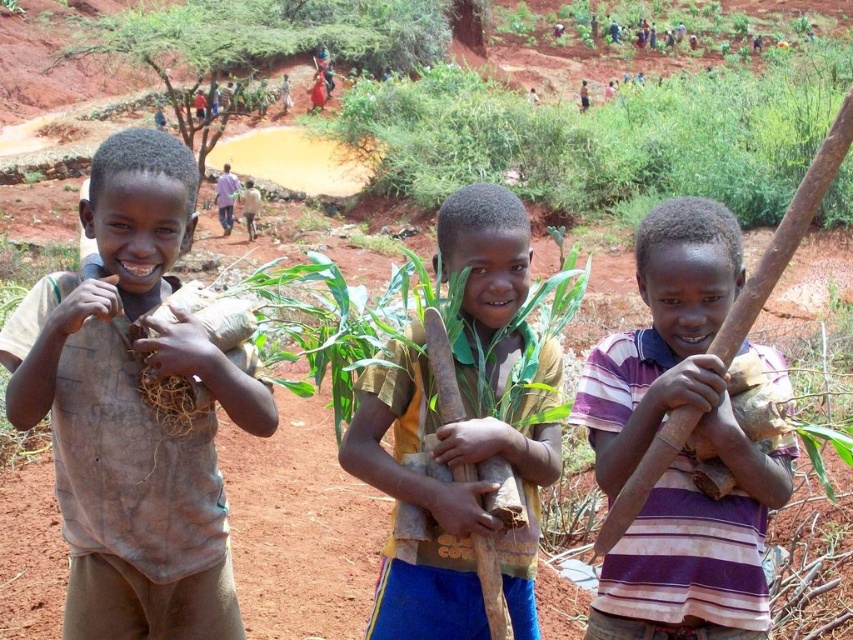
Question: Which of the following is the farthest from the observer?

Choices:
 (A) yellow cotton shirt at center
 (B) brown mud shirt at left
 (C) green leafy plant at upper center

Answer: (A)

Question: Which of the following is the closest to the observer?

Choices:
 (A) brown mud shirt at left
 (B) green leafy plant at upper center
 (C) yellow cotton shirt at center

Answer: (B)

Question: Can you confirm if green leafy plant at upper center is thinner than purple striped shirt at center?

Choices:
 (A) no
 (B) yes

Answer: (A)

Question: Can you confirm if brown mud shirt at left is bigger than purple striped shirt at center?

Choices:
 (A) yes
 (B) no

Answer: (B)

Question: Is yellow cotton shirt at center behind green leafy plant at upper center?

Choices:
 (A) no
 (B) yes

Answer: (B)

Question: Which point is closer to the camera?

Choices:
 (A) (534, 512)
 (B) (122, 390)
 (C) (666, 534)
 (D) (479, 88)

Answer: (C)